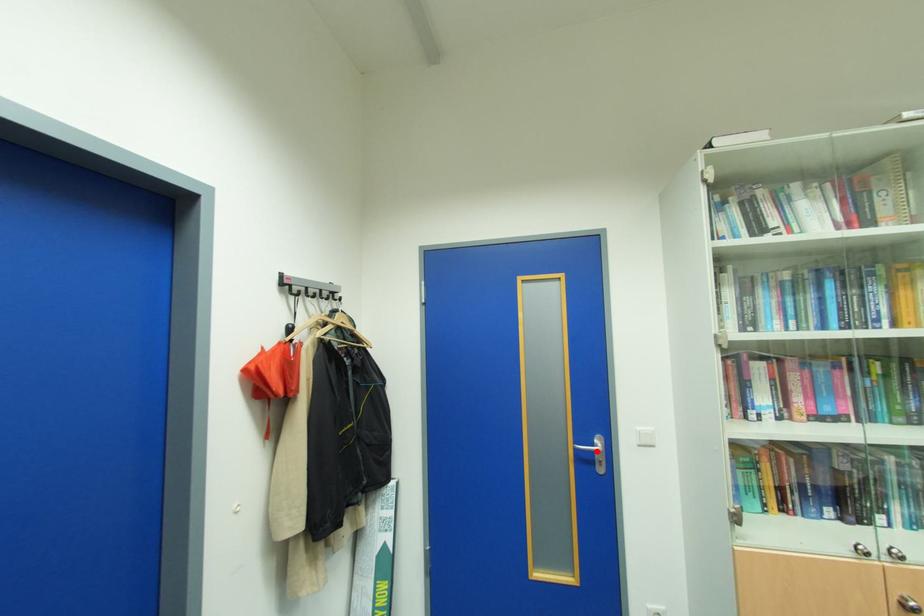
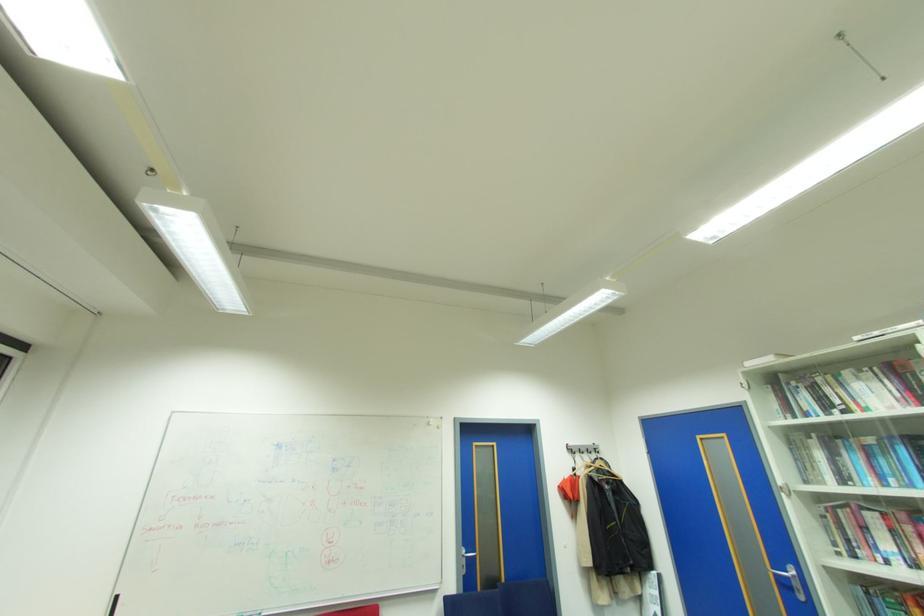
Question: A red point is marked in image1. In image2, is the corresponding 3D point closer to the camera or farther? Reply with the corresponding letter.

Choices:
 (A) The corresponding 3D point is closer.
 (B) The corresponding 3D point is farther.

Answer: (A)